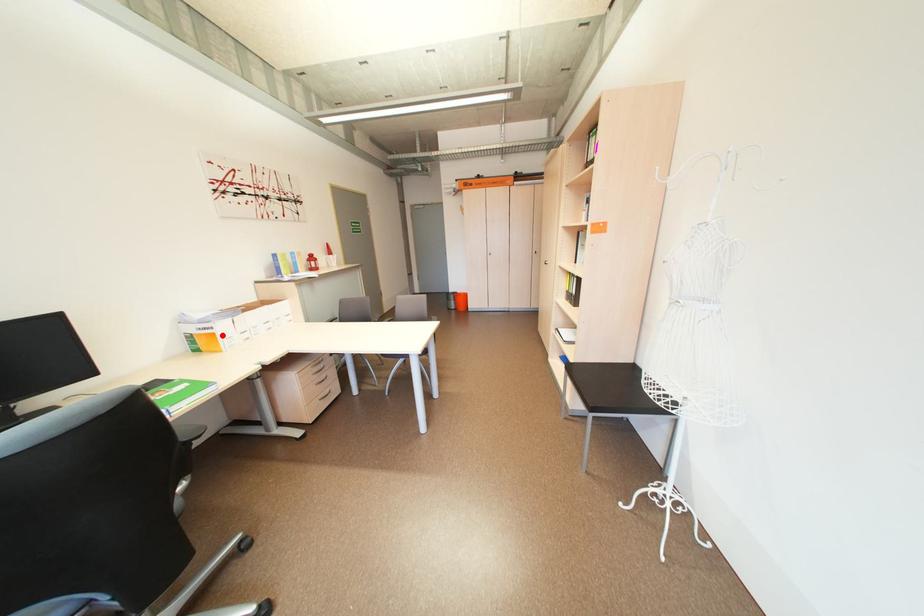
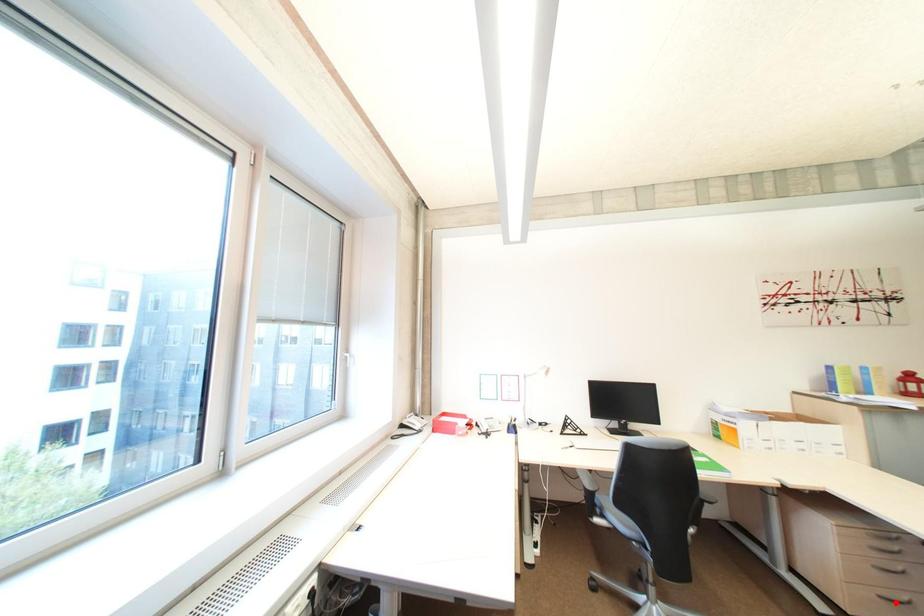
I am providing you with two images of the same scene from different viewpoints. A red point is marked on the first image and another point is marked on the second image. Is the red point in image1 aligned with the point shown in image2?

No